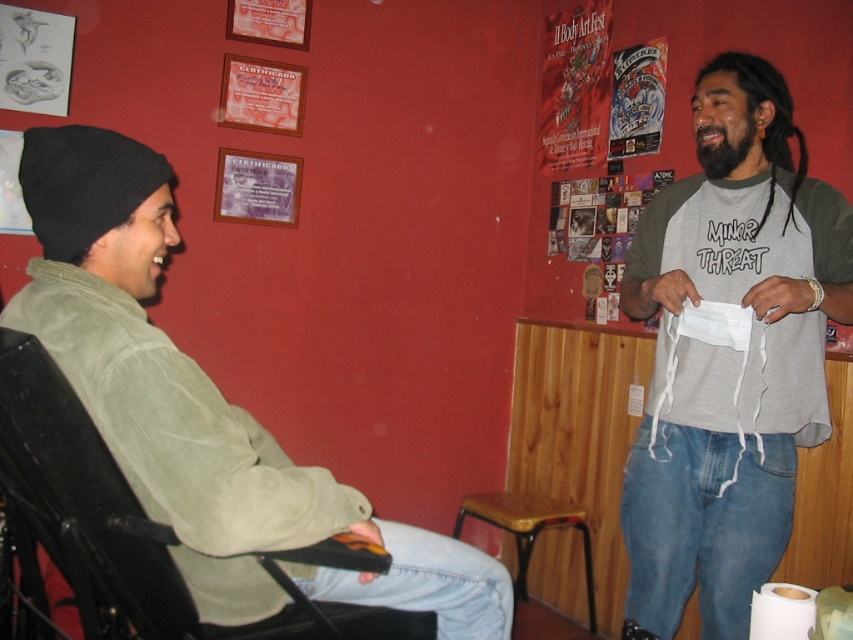
Between green corduroy jacket at left and leather-like stool at center, which one has more height?

Standing taller between the two is green corduroy jacket at left.

Is point (115, 266) closer to viewer compared to point (476, 508)?

Yes.

Is point (134, 416) farther from camera compared to point (593, 589)?

No.

This screenshot has height=640, width=853. In order to click on green corduroy jacket at left in this screenshot , I will do `click(202, 408)`.

Which is in front, point (733, 236) or point (122, 216)?

Point (122, 216) is in front.

Locate an element on the screen. Image resolution: width=853 pixels, height=640 pixels. gray cotton t-shirt at center is located at coordinates (729, 355).

Based on the photo, is gray cotton t-shirt at center below leather-like stool at center?

Incorrect, gray cotton t-shirt at center is not positioned below leather-like stool at center.

Is gray cotton t-shirt at center shorter than leather-like stool at center?

Incorrect, gray cotton t-shirt at center's height does not fall short of leather-like stool at center's.

Between point (759, 380) and point (520, 541), which one is positioned behind?

Positioned behind is point (520, 541).

At what (x,y) coordinates should I click in order to perform the action: click on gray cotton t-shirt at center. Please return your answer as a coordinate pair (x, y). The image size is (853, 640). Looking at the image, I should click on (729, 355).